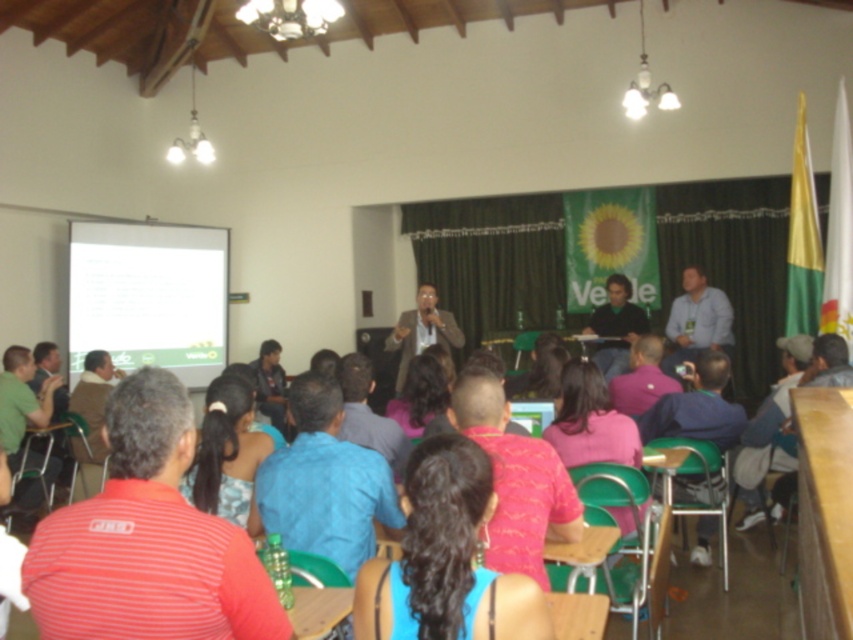
Question: Which of these objects is positioned farthest from the blue fabric shirt at lower center?

Choices:
 (A) white matte projection screen at left
 (B) blue denim jeans at lower right
 (C) red fabric shirt at center
 (D) brown leather jacket at lower left

Answer: (A)

Question: Which point appears farthest from the camera in this image?

Choices:
 (A) (317, 483)
 (B) (683, 419)

Answer: (B)

Question: Is red fabric shirt at center smaller than dark blue shirt at center?

Choices:
 (A) yes
 (B) no

Answer: (A)

Question: Where is white matte projection screen at left located in relation to matte black suit at center in the image?

Choices:
 (A) left
 (B) right

Answer: (A)

Question: Can you confirm if blue denim jeans at lower right is positioned to the left of matte black suit at center?

Choices:
 (A) yes
 (B) no

Answer: (B)

Question: Which point appears closest to the camera in this image?

Choices:
 (A) (753, 477)
 (B) (97, 397)
 (C) (604, 369)
 (D) (474, 403)

Answer: (D)